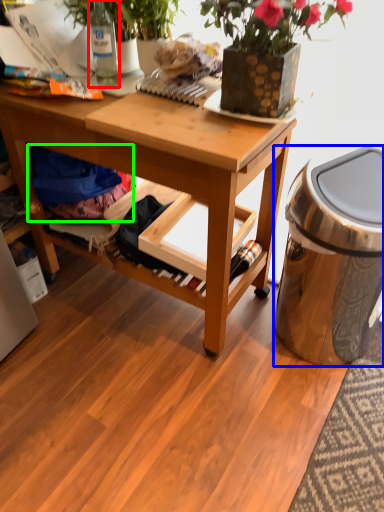
Question: Considering the real-world distances, which object is farthest from bottle (highlighted by a red box)? trash bin/can (highlighted by a blue box) or clothing (highlighted by a green box)?

Choices:
 (A) trash bin/can
 (B) clothing

Answer: (A)